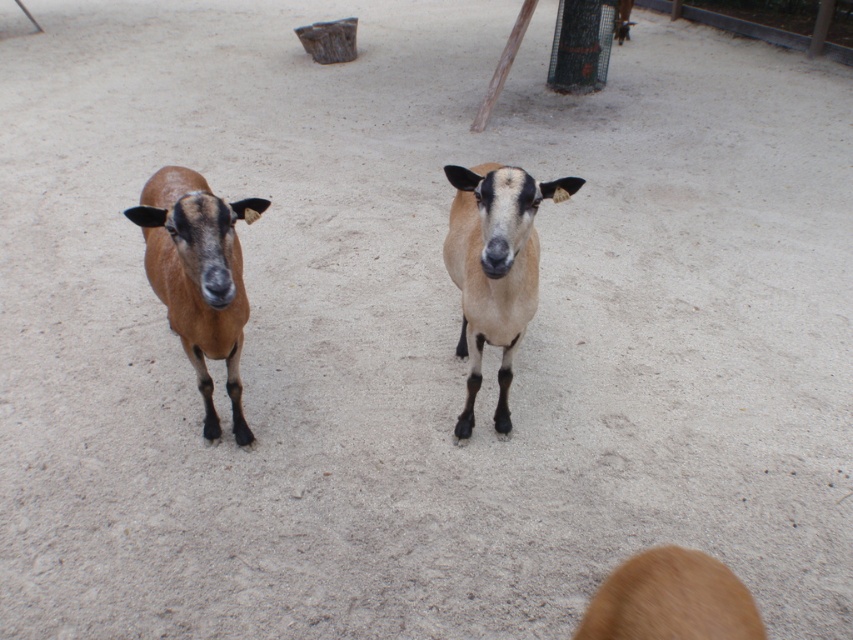
Can you confirm if brown matte goat at left is shorter than light brown fur goat at center?

No.

Based on the photo, who is more distant from viewer, (169, 278) or (496, 424)?

The point (496, 424) is behind.

Describe the element at coordinates (198, 276) in the screenshot. I see `brown matte goat at left` at that location.

Find the location of a particular element. The width and height of the screenshot is (853, 640). brown matte goat at left is located at coordinates (198, 276).

In the scene shown: Can you confirm if brown matte goat at left is smaller than brown fur at lower right?

No, brown matte goat at left is not smaller than brown fur at lower right.

Which is in front, point (196, 244) or point (689, 584)?

Point (689, 584) is more forward.

You are a GUI agent. You are given a task and a screenshot of the screen. Output one action in this format:
    pyautogui.click(x=<x>, y=<y>)
    Task: Click on the brown matte goat at left
    The width and height of the screenshot is (853, 640).
    Given the screenshot: What is the action you would take?
    pyautogui.click(x=198, y=276)

Is light brown fur goat at center to the right of brown fur at lower right from the viewer's perspective?

Incorrect, light brown fur goat at center is not on the right side of brown fur at lower right.

Which of these two, light brown fur goat at center or brown fur at lower right, stands shorter?

Standing shorter between the two is brown fur at lower right.

Where is `light brown fur goat at center`? This screenshot has width=853, height=640. light brown fur goat at center is located at coordinates (494, 268).

This screenshot has height=640, width=853. Identify the location of light brown fur goat at center. (494, 268).